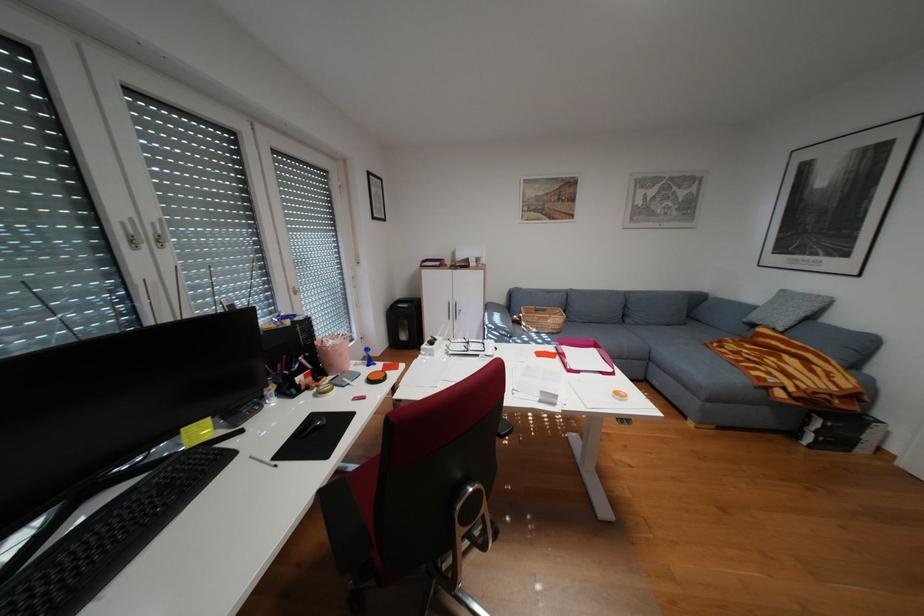
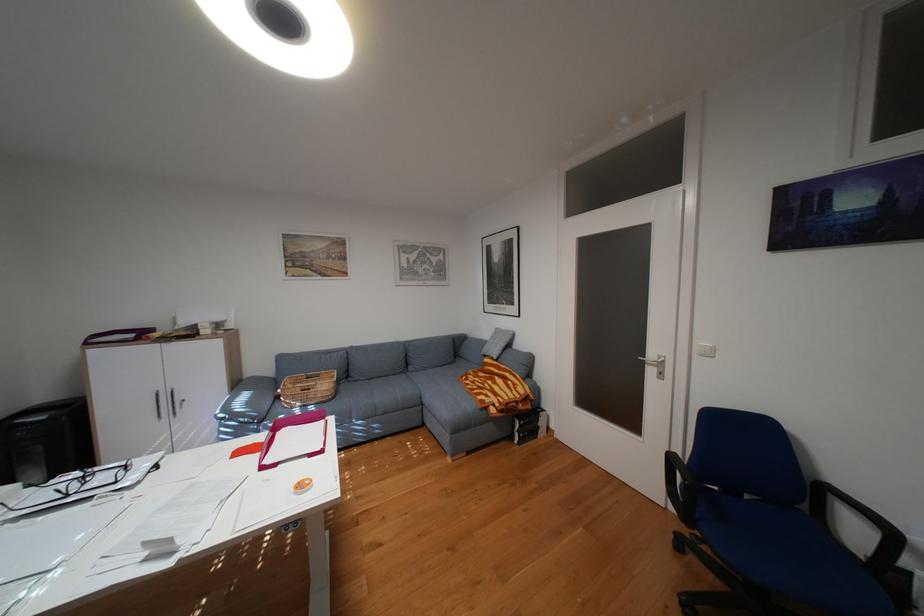
In the second image, find the point that corresponds to point 556,310 in the first image.

(331, 375)